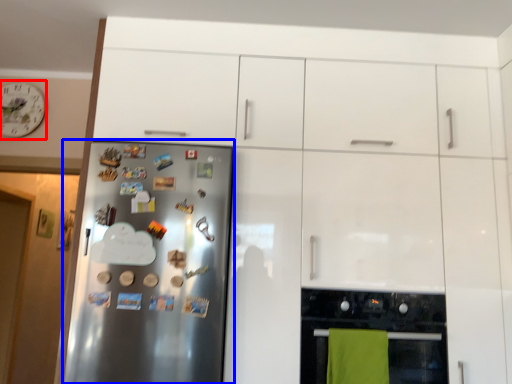
Question: Which object appears closest to the camera in this image, clock (highlighted by a red box) or refrigerator (highlighted by a blue box)?

Choices:
 (A) clock
 (B) refrigerator

Answer: (B)